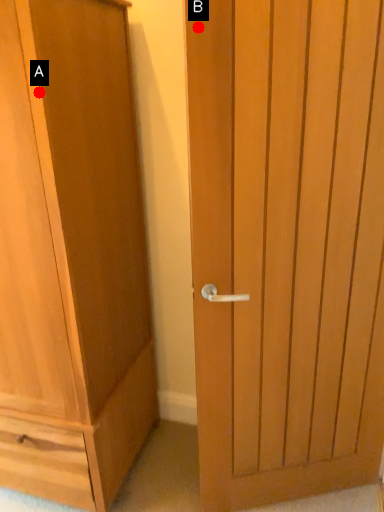
Question: Two points are circled on the image, labeled by A and B beside each circle. Which point is farther to the camera?

Choices:
 (A) A is further
 (B) B is further

Answer: (A)